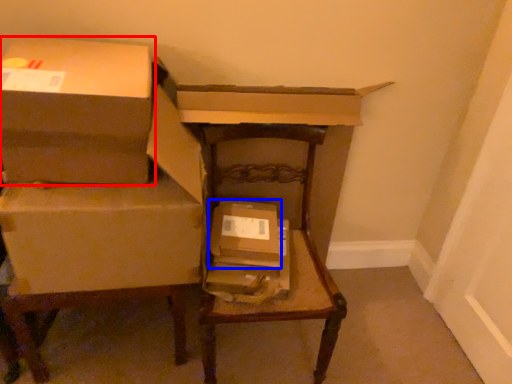
Question: Which object is further to the camera taking this photo, box (highlighted by a red box) or box (highlighted by a blue box)?

Choices:
 (A) box
 (B) box

Answer: (B)